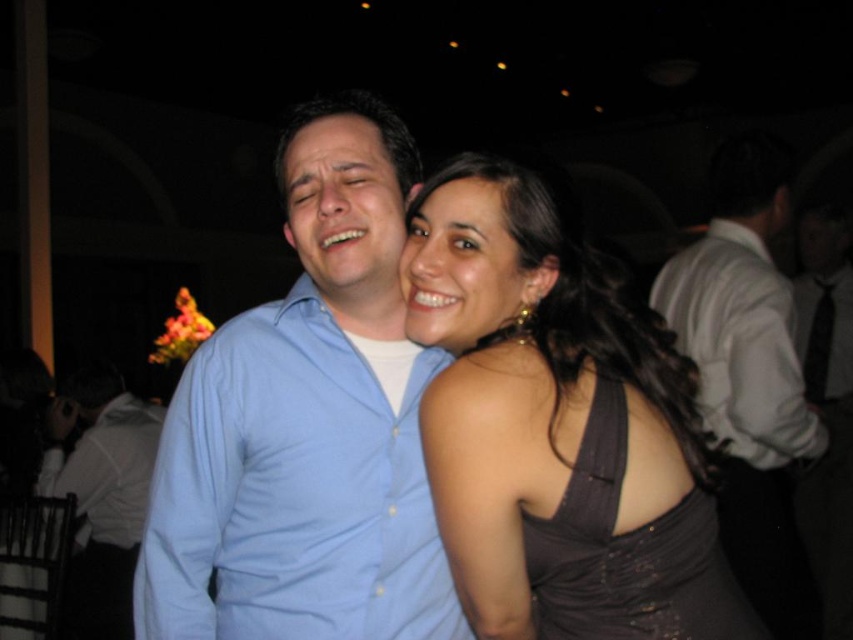
You are a photographer at a social event and need to position a spotlight exactly at the point marked by coordinates point (556, 428). According to the scene, what object will be illuminated by this spotlight?

The point (556, 428) marks the satin black dress at center, so the spotlight will illuminate the satin black dress at center.